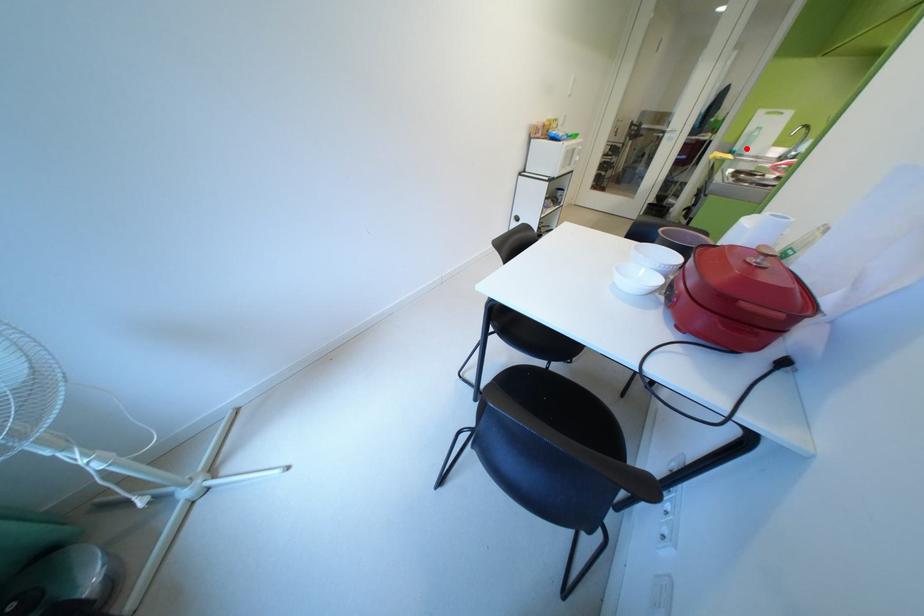
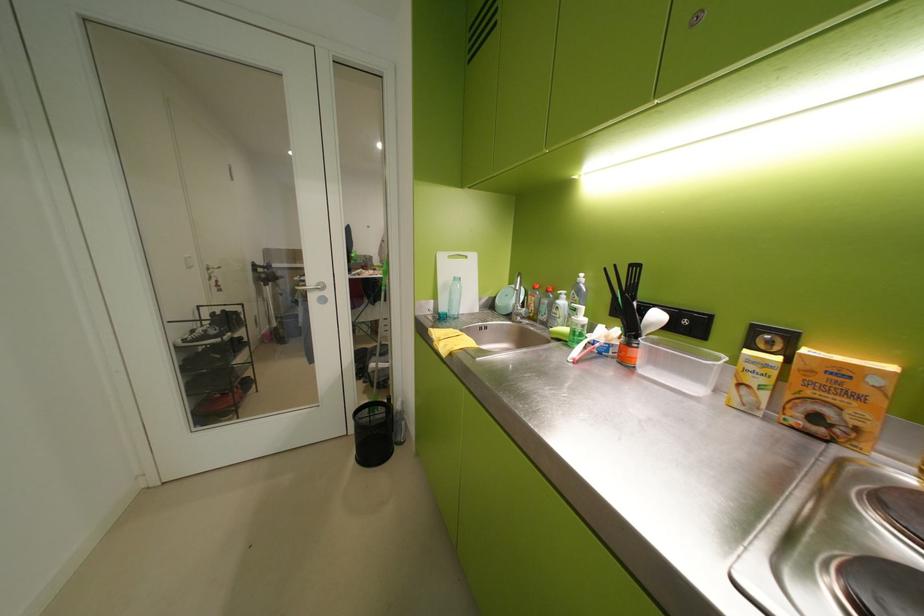
Where in the second image is the point corresponding to the highlighted location from the first image?

(453, 310)